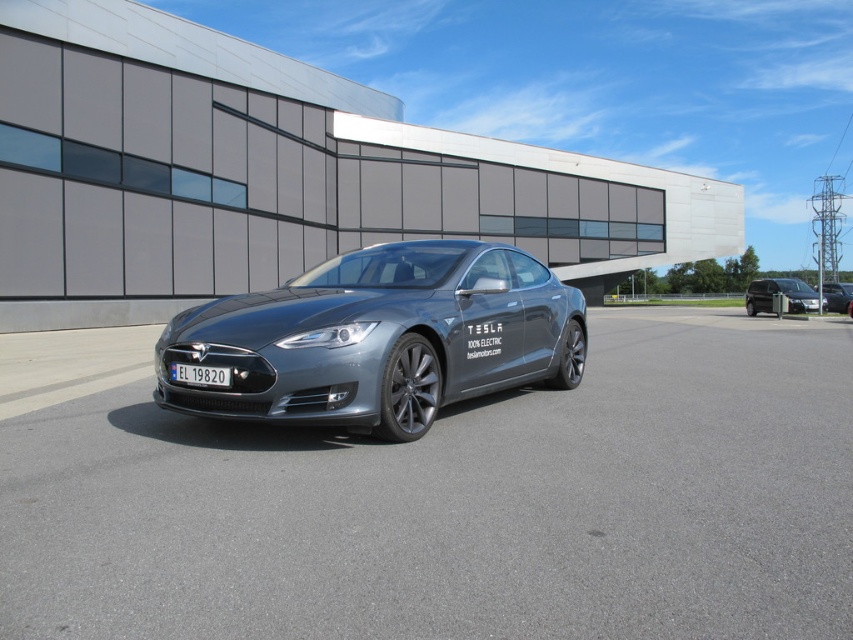
You are a photographer standing in front of the Tesla Model S parked in front of the modern building. You want to capture a shot that includes both the sleek metallic car at center and the metallic silver sedan at center. Which car should you position to the left side of your frame to include both in the photo?

You should position the sleek metallic car at center to the left side of your frame since it is already to the left of the metallic silver sedan at center, ensuring both are included in the photo.

Based on the photo, you are a delivery driver who needs to park your truck next to the Tesla Model S in the image. The metallic silver van at right is currently parked 5.77 feet away from the metallic silver sedan at center. If your truck requires a minimum of 6 feet of space to safely maneuver, can you park your truck between them without moving the existing vehicles?

The metallic silver van at right is currently parked 5.77 feet away from the metallic silver sedan at center, which is less than the required 6 feet of space needed for your truck to safely maneuver. Therefore, you cannot park your truck between them without moving the existing vehicles.

You are a delivery person trying to park your metallic silver van at right in a parking lot. There is already a sleek metallic car at center parked there. Can you park your van without overlapping the car?

The sleek metallic car at center is positioned under the metallic silver van at right, meaning the van is above the car in the image. Since parking spaces are on the ground, the van cannot be parked above the car. Therefore, you cannot park the metallic silver van at right without overlapping the car.